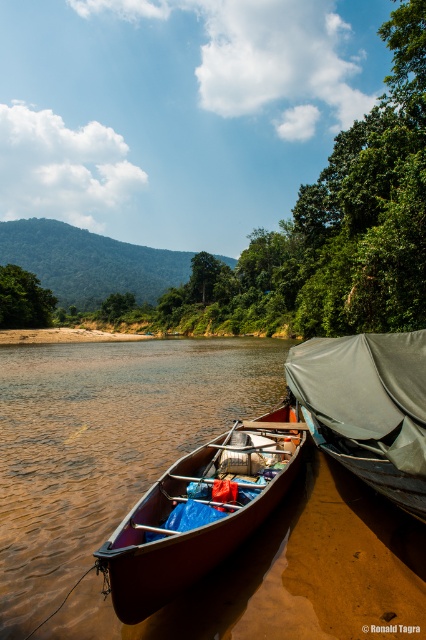
Which is in front, point (97, 552) or point (305, 349)?

Point (97, 552) is more forward.

The height and width of the screenshot is (640, 426). Identify the location of wooden canoe at center. (201, 509).

You are a GUI agent. You are given a task and a screenshot of the screen. Output one action in this format:
    pyautogui.click(x=<x>, y=<y>)
    Task: Click on the wooden canoe at center
    The image size is (426, 640).
    Given the screenshot: What is the action you would take?
    click(x=201, y=509)